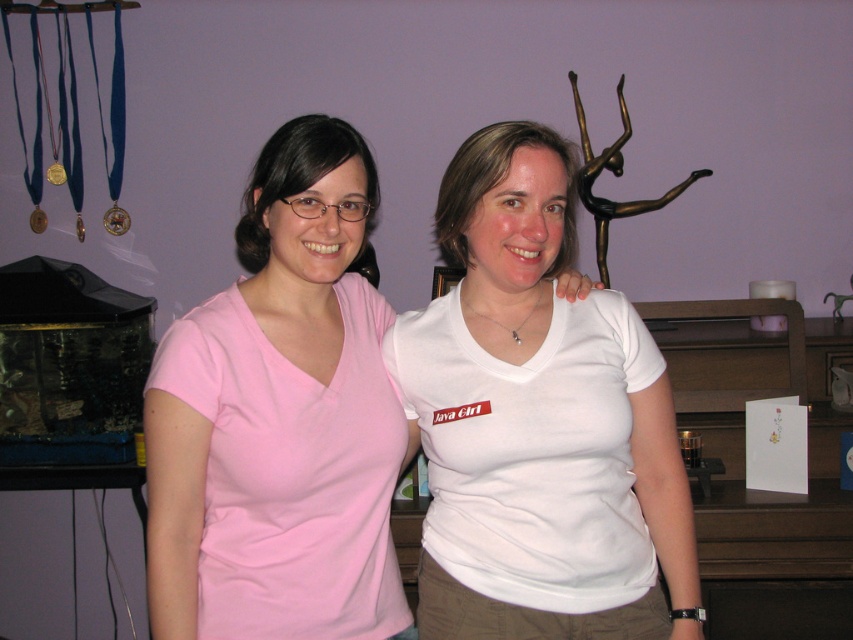
Does white matte shirt at center appear under pink matte t-shirt at center?

Yes.

You are a GUI agent. You are given a task and a screenshot of the screen. Output one action in this format:
    pyautogui.click(x=<x>, y=<y>)
    Task: Click on the white matte shirt at center
    Image resolution: width=853 pixels, height=640 pixels.
    Given the screenshot: What is the action you would take?
    pyautogui.click(x=537, y=422)

Who is more distant from viewer, (x=448, y=300) or (x=265, y=636)?

The point (x=448, y=300) is more distant.

Where is `white matte shirt at center`? white matte shirt at center is located at coordinates (537, 422).